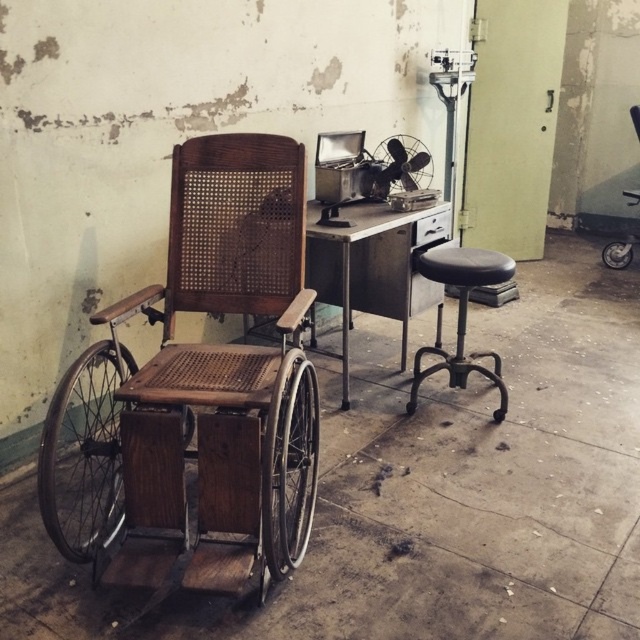
Question: Observing the image, what is the correct spatial positioning of wooden cane wheelchair at left in reference to metallic silver fan at center?

Choices:
 (A) right
 (B) left

Answer: (B)

Question: In this image, where is wooden cane wheelchair at left located relative to metallic/textured desk at center?

Choices:
 (A) left
 (B) right

Answer: (A)

Question: Which of these objects is positioned farthest from the metallic silver fan at center?

Choices:
 (A) metallic/textured desk at center
 (B) black leather swivel chair at right
 (C) black leather stool at right

Answer: (B)

Question: Does black leather stool at right appear on the left side of metallic silver fan at center?

Choices:
 (A) yes
 (B) no

Answer: (B)

Question: Which object is positioned farthest from the metallic silver fan at center?

Choices:
 (A) metallic/textured desk at center
 (B) black leather stool at right
 (C) wooden cane wheelchair at left
 (D) black leather swivel chair at right

Answer: (D)

Question: Among these points, which one is farthest from the camera?

Choices:
 (A) (410, 177)
 (B) (369, 236)
 (C) (273, 433)
 (D) (624, 256)

Answer: (D)